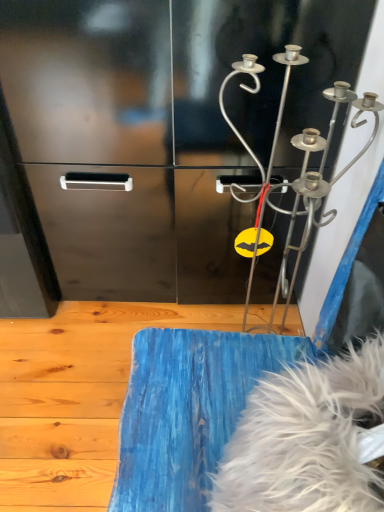
At what (x,y) coordinates should I click in order to perform the action: click on blue painted wood at lower center. Please return your answer as a coordinate pair (x, y). Looking at the image, I should click on (75, 396).

Image resolution: width=384 pixels, height=512 pixels. Describe the element at coordinates (75, 396) in the screenshot. I see `blue painted wood at lower center` at that location.

You are a GUI agent. You are given a task and a screenshot of the screen. Output one action in this format:
    pyautogui.click(x=<x>, y=<y>)
    Task: Click on the silver metallic wind chime at upper right
    The image size is (384, 512).
    Given the screenshot: What is the action you would take?
    pyautogui.click(x=321, y=174)

What do you see at coordinates (245, 425) in the screenshot? The image size is (384, 512). I see `white fluffy feather at lower right` at bounding box center [245, 425].

This screenshot has height=512, width=384. In order to click on blue painted wood at lower center in this screenshot , I will do `click(75, 396)`.

Is blue painted wood at lower center oriented away from white fluffy feather at lower right?

No, white fluffy feather at lower right is not at the back of blue painted wood at lower center.

Measure the distance between blue painted wood at lower center and white fluffy feather at lower right.

They are 59.02 centimeters apart.

Is blue painted wood at lower center in front of or behind white fluffy feather at lower right in the image?

Clearly, blue painted wood at lower center is behind white fluffy feather at lower right.

Which of these two, blue painted wood at lower center or white fluffy feather at lower right, stands taller?

Standing taller between the two is white fluffy feather at lower right.

Based on the photo, how different are the orientations of blue painted wood at lower center and silver metallic wind chime at upper right in degrees?

The angular difference between blue painted wood at lower center and silver metallic wind chime at upper right is 89.7 degrees.

Which object is positioned more to the left, blue painted wood at lower center or silver metallic wind chime at upper right?

Positioned to the left is blue painted wood at lower center.

From a real-world perspective, which is physically above, blue painted wood at lower center or silver metallic wind chime at upper right?

silver metallic wind chime at upper right, from a real-world perspective.

Considering the positions of points (18, 338) and (332, 217), is point (18, 338) closer to camera compared to point (332, 217)?

No, it is not.

From the image's perspective, between white fluffy feather at lower right and silver metallic wind chime at upper right, who is located below?

white fluffy feather at lower right, from the image's perspective.

Is white fluffy feather at lower right looking in the opposite direction of silver metallic wind chime at upper right?

No, silver metallic wind chime at upper right is not at the back of white fluffy feather at lower right.

From a real-world perspective, is white fluffy feather at lower right above or below silver metallic wind chime at upper right?

In terms of real-world spatial position, white fluffy feather at lower right is below silver metallic wind chime at upper right.

Can you tell me how much white fluffy feather at lower right and silver metallic wind chime at upper right differ in facing direction?

The facing directions of white fluffy feather at lower right and silver metallic wind chime at upper right are 1.48 degrees apart.

What's the angular difference between silver metallic wind chime at upper right and white fluffy feather at lower right's facing directions?

silver metallic wind chime at upper right and white fluffy feather at lower right are facing 1.48 degrees away from each other.

Is silver metallic wind chime at upper right positioned behind white fluffy feather at lower right?

That is True.

Considering the sizes of objects silver metallic wind chime at upper right and white fluffy feather at lower right in the image provided, who is thinner, silver metallic wind chime at upper right or white fluffy feather at lower right?

white fluffy feather at lower right is thinner.

From the picture: Which is correct: silver metallic wind chime at upper right is inside blue painted wood at lower center, or outside of it?

silver metallic wind chime at upper right cannot be found inside blue painted wood at lower center.

Is silver metallic wind chime at upper right facing towards blue painted wood at lower center?

Yes, silver metallic wind chime at upper right faces towards blue painted wood at lower center.

Is silver metallic wind chime at upper right wider than blue painted wood at lower center?

No.

Is silver metallic wind chime at upper right far from blue painted wood at lower center?

silver metallic wind chime at upper right is near blue painted wood at lower center, not far away.

From the picture: Considering the sizes of objects white fluffy feather at lower right and blue painted wood at lower center in the image provided, who is smaller, white fluffy feather at lower right or blue painted wood at lower center?

Smaller between the two is white fluffy feather at lower right.

Based on the photo, between white fluffy feather at lower right and blue painted wood at lower center, which one has less height?

blue painted wood at lower center.

Would you say white fluffy feather at lower right is a long distance from blue painted wood at lower center?

No, white fluffy feather at lower right is not far away from blue painted wood at lower center.

From a real-world perspective, is white fluffy feather at lower right positioned above or below blue painted wood at lower center?

white fluffy feather at lower right is situated higher than blue painted wood at lower center in the real world.

Find the location of `furniture located above the blue painted wood at lower center (from the image's perspective)`. furniture located above the blue painted wood at lower center (from the image's perspective) is located at coordinates (245, 425).

Identify the location of wind chime that is above the blue painted wood at lower center (from a real-world perspective). The height and width of the screenshot is (512, 384). (321, 174).

Estimate the real-world distances between objects in this image. Which object is closer to silver metallic wind chime at upper right, blue painted wood at lower center or white fluffy feather at lower right?

white fluffy feather at lower right is closer to silver metallic wind chime at upper right.

Estimate the real-world distances between objects in this image. Which object is closer to blue painted wood at lower center, white fluffy feather at lower right or silver metallic wind chime at upper right?

white fluffy feather at lower right lies closer to blue painted wood at lower center than the other object.

When comparing their distances from blue painted wood at lower center, does silver metallic wind chime at upper right or white fluffy feather at lower right seem further?

silver metallic wind chime at upper right is further to blue painted wood at lower center.

Estimate the real-world distances between objects in this image. Which object is further from silver metallic wind chime at upper right, white fluffy feather at lower right or blue painted wood at lower center?

blue painted wood at lower center is positioned further to the anchor silver metallic wind chime at upper right.

Based on their spatial positions, is blue painted wood at lower center or silver metallic wind chime at upper right further from white fluffy feather at lower right?

blue painted wood at lower center is further to white fluffy feather at lower right.

Looking at the image, which one is located closer to white fluffy feather at lower right, silver metallic wind chime at upper right or blue painted wood at lower center?

Among the two, silver metallic wind chime at upper right is located nearer to white fluffy feather at lower right.

The image size is (384, 512). Identify the location of wind chime located between white fluffy feather at lower right and blue painted wood at lower center in the depth direction. (321, 174).